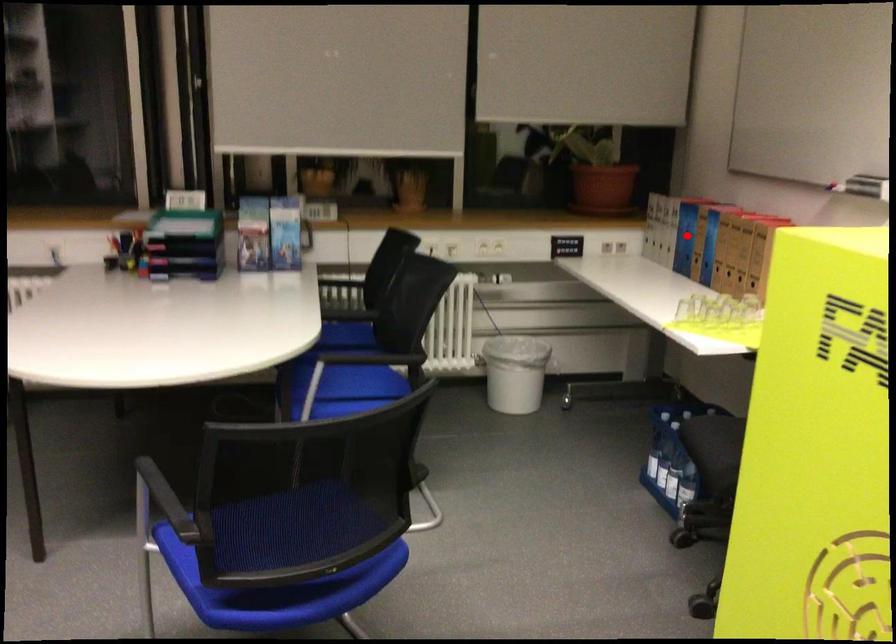
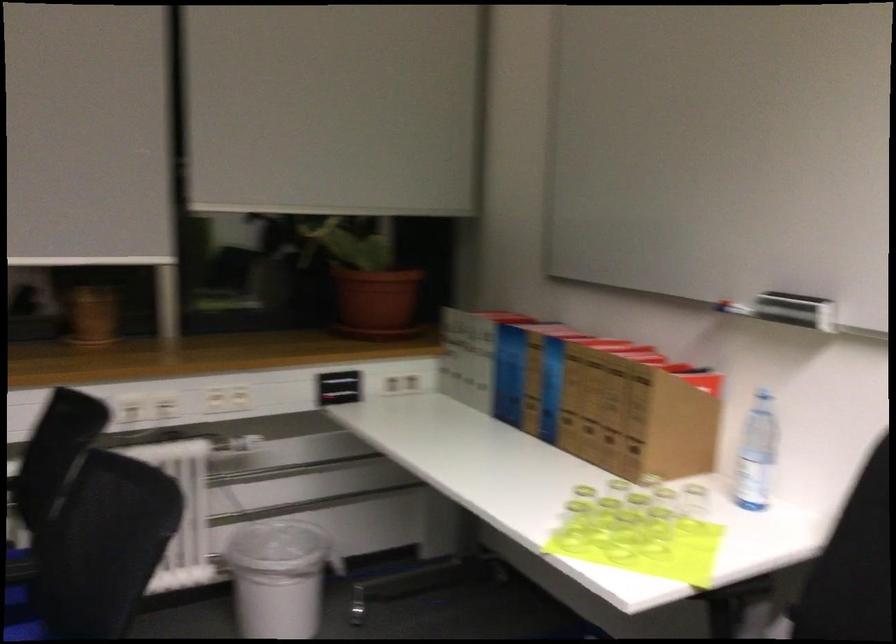
In the second image, find the point that corresponds to the highlighted location in the first image.

(509, 374)